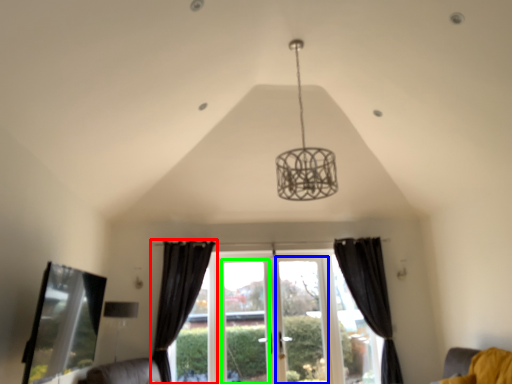
Question: Considering the real-world distances, which object is closest to curtain (highlighted by a red box)? screen door (highlighted by a blue box) or window frame (highlighted by a green box).

Choices:
 (A) screen door
 (B) window frame

Answer: (B)